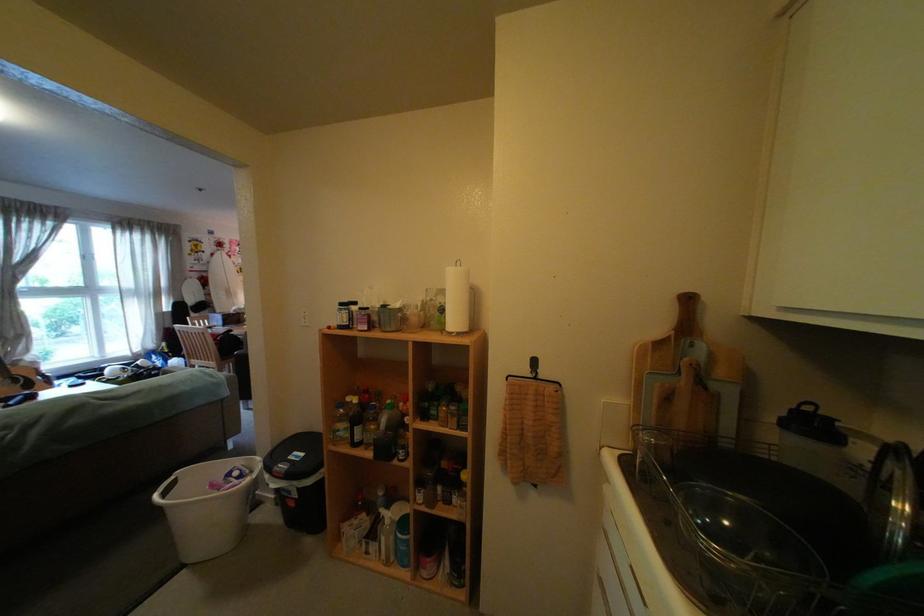
Describe the element at coordinates (456, 300) in the screenshot. The width and height of the screenshot is (924, 616). I see `the paper towel roll` at that location.